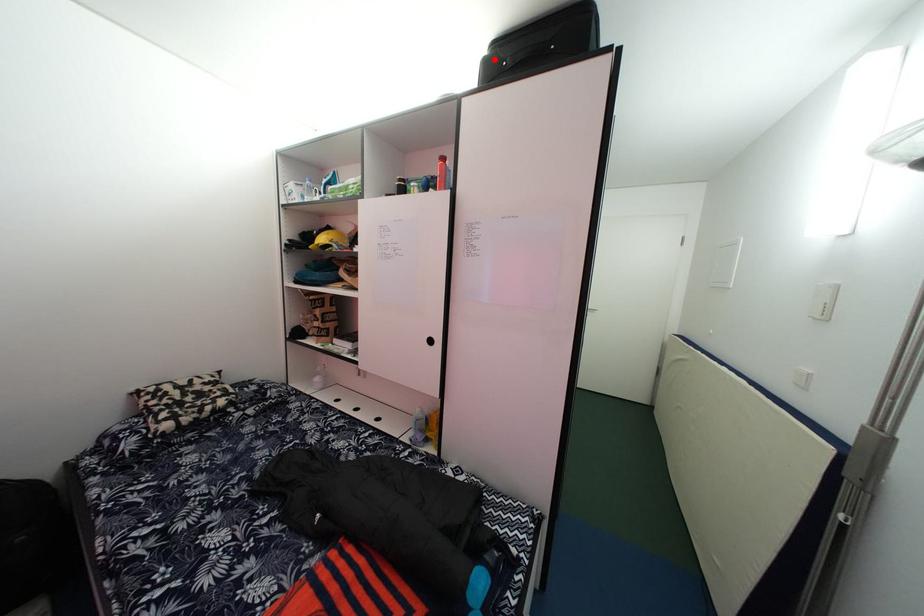
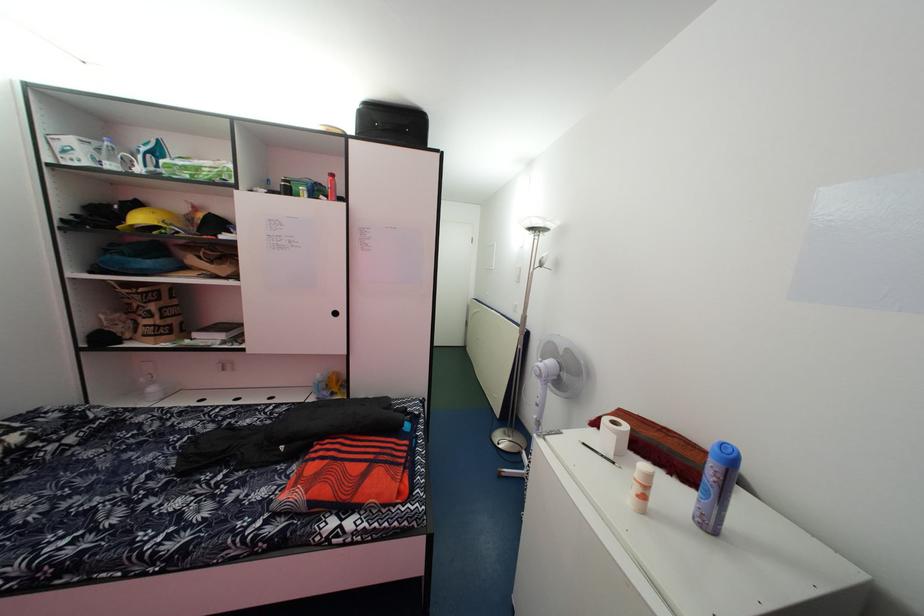
Find the pixel in the second image that matches the highlighted location in the first image.

(367, 111)